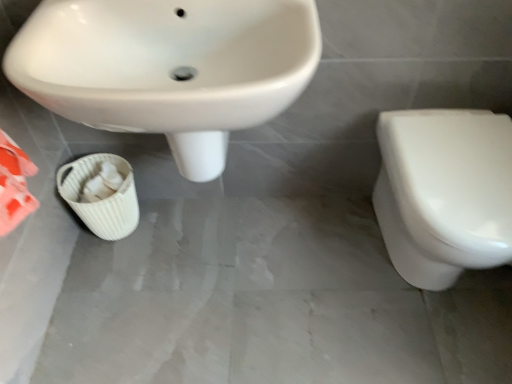
This screenshot has height=384, width=512. In order to click on vacant region above white glossy toilet at right (from a real-world perspective) in this screenshot , I will do `click(463, 155)`.